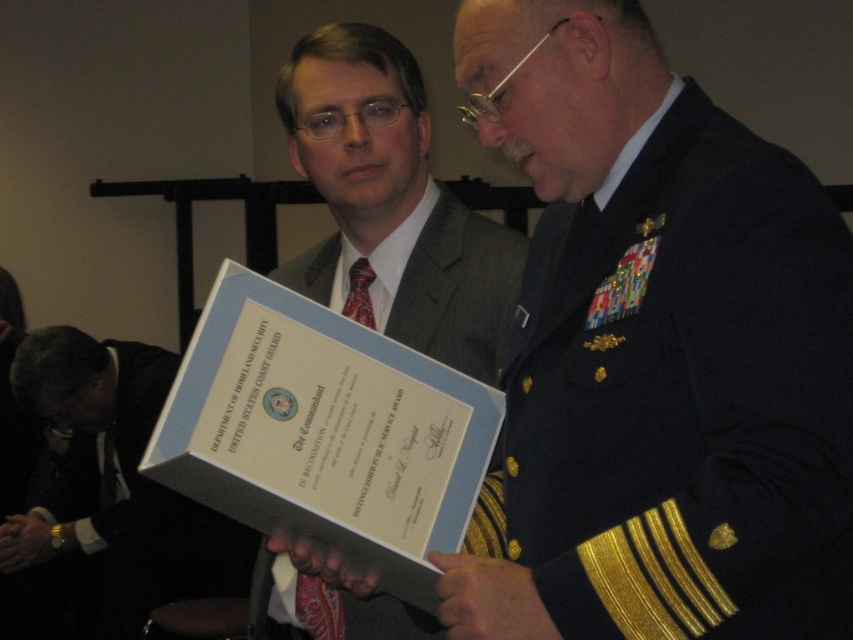
Question: Is matte black suit at center bigger than matte gray suit at center?

Choices:
 (A) no
 (B) yes

Answer: (B)

Question: Which point appears farthest from the camera in this image?

Choices:
 (A) (579, 516)
 (B) (413, 182)
 (C) (196, 582)

Answer: (C)

Question: Which of the following is the closest to the observer?

Choices:
 (A) matte gray suit at center
 (B) matte black suit at lower left

Answer: (A)

Question: Which of the following is the closest to the observer?

Choices:
 (A) matte black suit at lower left
 (B) matte black suit at center

Answer: (B)

Question: Can you confirm if matte black suit at center is positioned below matte gray suit at center?

Choices:
 (A) no
 (B) yes

Answer: (B)

Question: In this image, where is matte black suit at center located relative to matte gray suit at center?

Choices:
 (A) below
 (B) above

Answer: (A)